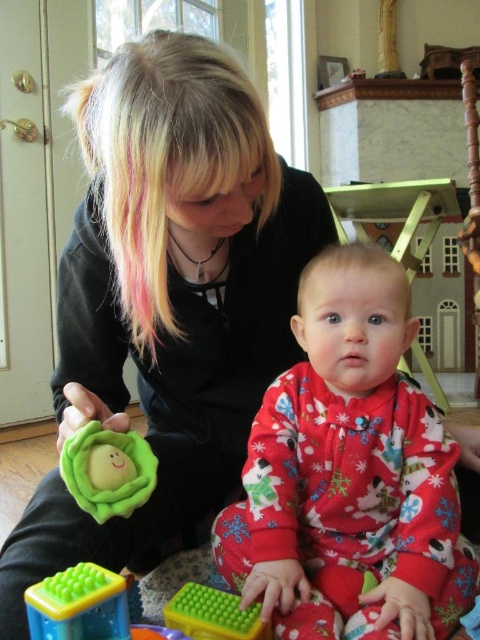
Which is more to the right, fluffy red pajamas at center or green rubber ball at center?

From the viewer's perspective, fluffy red pajamas at center appears more on the right side.

Is fluffy red pajamas at center smaller than green rubber ball at center?

Incorrect, fluffy red pajamas at center is not smaller in size than green rubber ball at center.

The image size is (480, 640). In order to click on fluffy red pajamas at center in this screenshot , I will do `click(348, 472)`.

Can you confirm if matte black sweater at center is taller than green plastic toy at lower center?

Correct, matte black sweater at center is much taller as green plastic toy at lower center.

Between matte black sweater at center and green plastic toy at lower center, which one appears on the left side from the viewer's perspective?

green plastic toy at lower center

Between point (244, 394) and point (72, 568), which one is positioned behind?

The point (244, 394) is more distant.

Where is `matte black sweater at center`? Image resolution: width=480 pixels, height=640 pixels. matte black sweater at center is located at coordinates (168, 298).

Does point (320, 342) lie in front of point (197, 618)?

No, it is not.

Looking at this image, is fluffy red pajamas at center to the right of green rubbery textured toy at lower center from the viewer's perspective?

Yes, fluffy red pajamas at center is to the right of green rubbery textured toy at lower center.

Measure the distance between point (315, 589) and camera.

36.26 inches

Where is `fluffy red pajamas at center`? Image resolution: width=480 pixels, height=640 pixels. fluffy red pajamas at center is located at coordinates (348, 472).